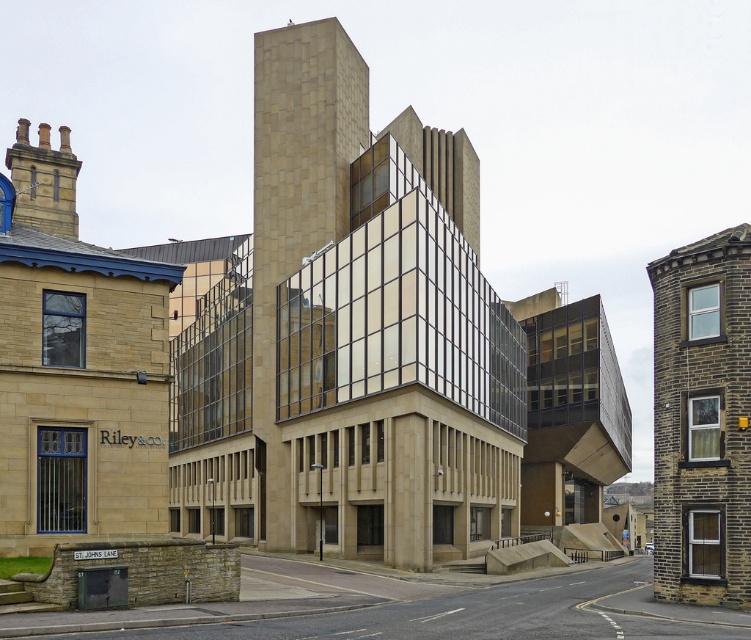
Question: Is the position of beige stone tower at center more distant than that of brown stone tower at right?

Choices:
 (A) yes
 (B) no

Answer: (A)

Question: Which point is closer to the camera?

Choices:
 (A) (353, 468)
 (B) (704, 548)

Answer: (B)

Question: Which of the following is the closest to the observer?

Choices:
 (A) (722, 480)
 (B) (427, 529)

Answer: (A)

Question: Is beige stone tower at center bigger than brown stone tower at right?

Choices:
 (A) no
 (B) yes

Answer: (B)

Question: Can you confirm if beige stone tower at center is wider than brown stone tower at right?

Choices:
 (A) yes
 (B) no

Answer: (A)

Question: Which point appears farthest from the camera in this image?

Choices:
 (A) (719, 305)
 (B) (484, 451)

Answer: (B)